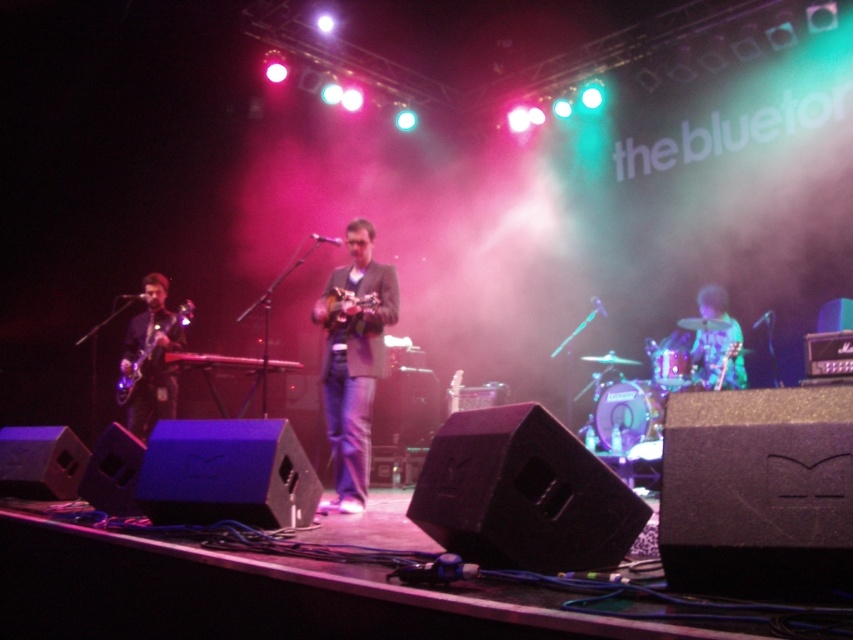
Question: Among these objects, which one is nearest to the camera?

Choices:
 (A) matte brown guitar at center
 (B) green textured guitar at right

Answer: (A)

Question: Estimate the real-world distances between objects in this image. Which object is closer to the metallic silver keyboard at center?

Choices:
 (A) matte black guitar at left
 (B) matte brown guitar at center

Answer: (A)

Question: Does matte gray suit at center have a lesser width compared to metallic silver keyboard at center?

Choices:
 (A) yes
 (B) no

Answer: (A)

Question: Is matte black guitar at left wider than metallic silver keyboard at center?

Choices:
 (A) no
 (B) yes

Answer: (A)

Question: Which is farther from the matte brown guitar at center?

Choices:
 (A) green textured guitar at right
 (B) metallic silver keyboard at center
 (C) matte black guitar at left
 (D) matte gray suit at center

Answer: (A)

Question: From the image, what is the correct spatial relationship of matte gray suit at center in relation to matte brown guitar at center?

Choices:
 (A) below
 (B) above

Answer: (A)